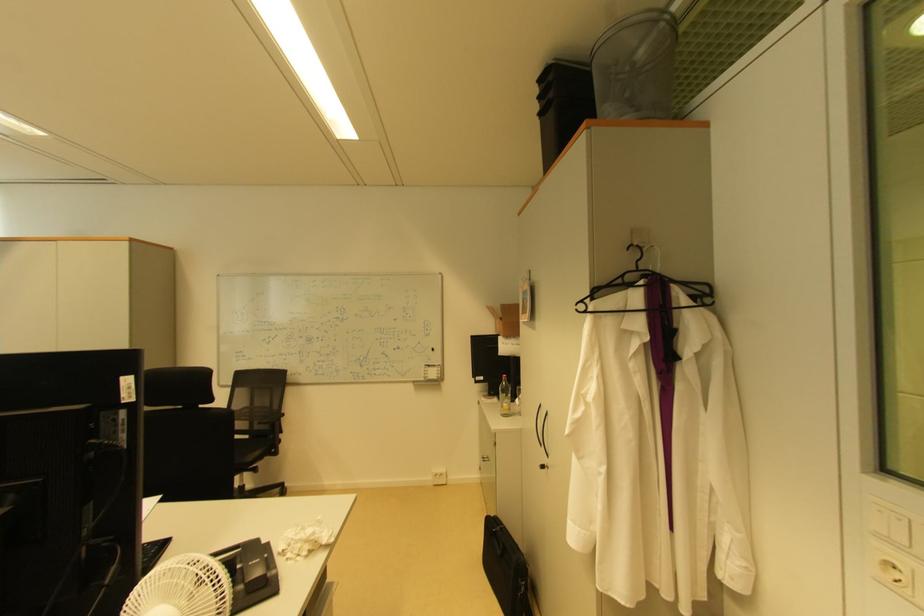
Find where to lift the phone handset. Please return your answer as a coordinate pair (x, y).

(252, 565)